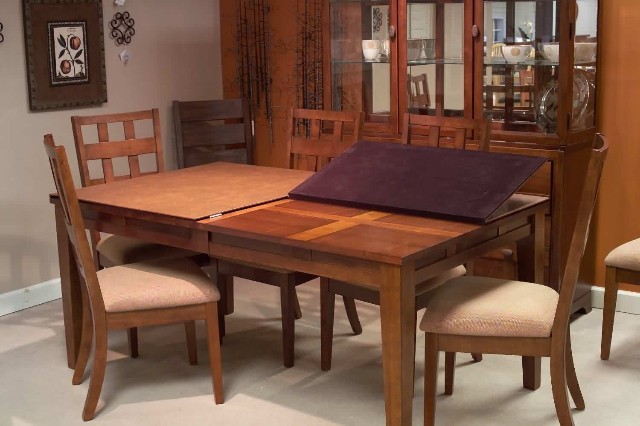
The width and height of the screenshot is (640, 426). I want to click on bottom side of table cover, so click(454, 193).